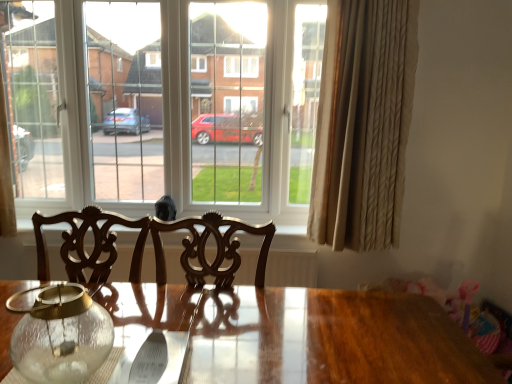
Question: Based on their positions, is beige textured curtain at right located to the left or right of clear glass window at center?

Choices:
 (A) right
 (B) left

Answer: (A)

Question: From a real-world perspective, relative to clear glass window at center, is beige textured curtain at right vertically above or below?

Choices:
 (A) above
 (B) below

Answer: (B)

Question: Which object is the closest to the clear glass window at center?

Choices:
 (A) transparent glass jar at lower left
 (B) beige textured curtain at right

Answer: (B)

Question: Which is nearer to the transparent glass jar at lower left?

Choices:
 (A) clear glass window at center
 (B) beige textured curtain at right

Answer: (B)